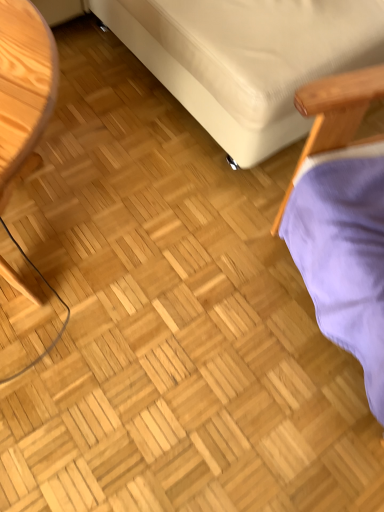
Describe the element at coordinates (344, 252) in the screenshot. Image resolution: width=384 pixels, height=512 pixels. I see `purple fabric pillow at right` at that location.

In order to face purple fabric pillow at right, should I rotate leftwards or rightwards?

Rotate right and turn 31.742 degrees.

Where is `purple fabric pillow at right`? Image resolution: width=384 pixels, height=512 pixels. purple fabric pillow at right is located at coordinates click(x=344, y=252).

The height and width of the screenshot is (512, 384). I want to click on purple fabric pillow at right, so click(x=344, y=252).